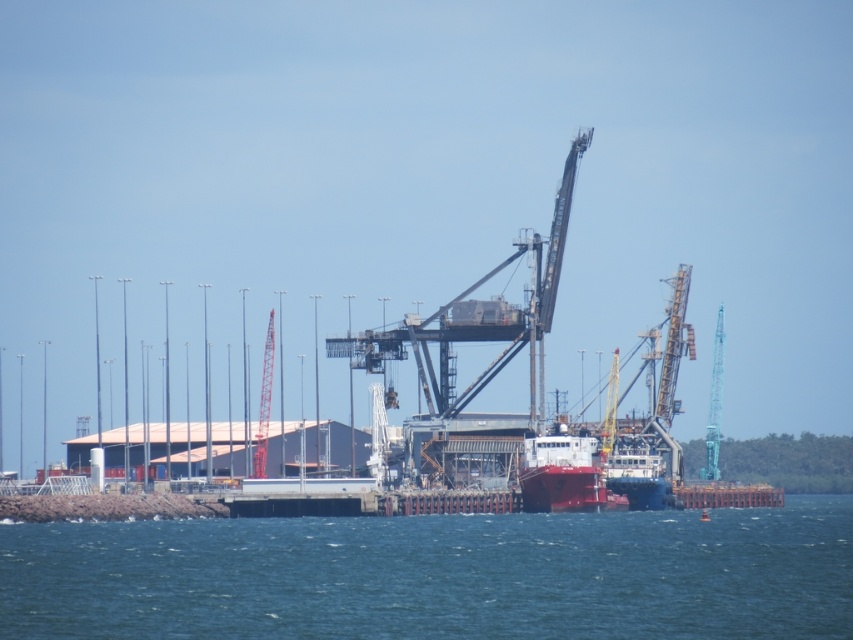
In the scene shown: You are a port worker standing at the edge of the dock. You need to move a container from the blue water at lower center to the smooth red ship at center. Which direction should you move the container to reach the ship?

The blue water at lower center is to the left of the smooth red ship at center, so you should move the container to the right to reach the ship.

You are a port worker who needs to secure a large cargo container on the smooth red ship at center. Considering the blue water at lower center, what should you be cautious about?

The blue water at lower center has a larger size compared to the smooth red ship at center, so you should be cautious about the water potentially splashing onto the ship or causing instability due to its proximity and size.